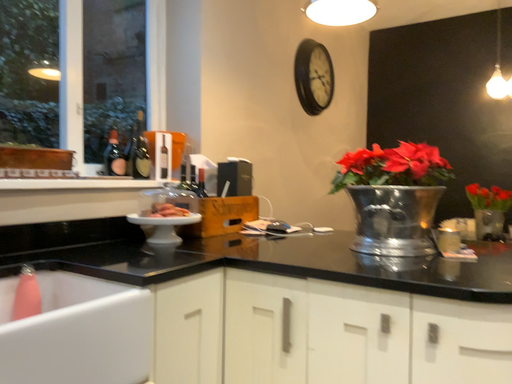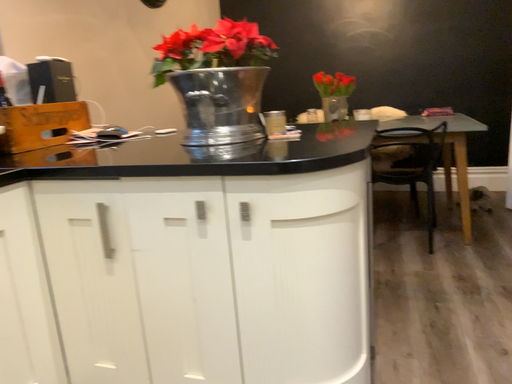
Question: Which way did the camera rotate in the video?

Choices:
 (A) rotated left
 (B) rotated right

Answer: (B)